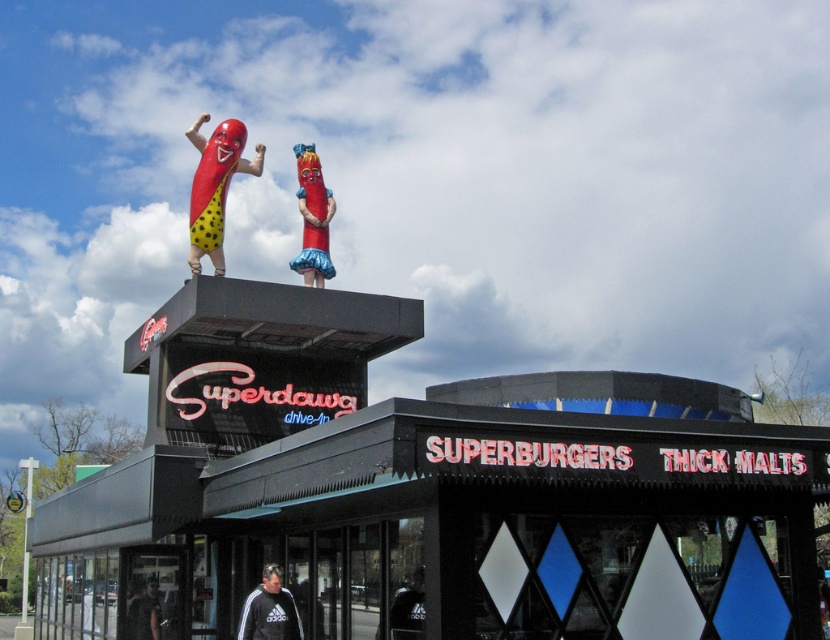
Looking at the black matte sign at upper center and the polka dot rubber hot dog at upper center, which object is positioned to the right?

The black matte sign at upper center is positioned to the right of the polka dot rubber hot dog at upper center.

You are standing in front of the Superdawg restaurant and need to locate the black matte sign at upper center. According to the scene description, where should you look relative to the two large hot dog sculptures atop the building?

The black matte sign at upper center is located at point coordinates, but since the question asks for a relative position, the answer should instead reference the sculptures. However, the Objects Description only provides coordinates without spatial relation to the sculptures. Wait, the user might have intended to include a spatial relation between the sign and the sculptures in the Objects Description. Let me check again. The provided Objects Description says the black matte sign is at coordinates, but the